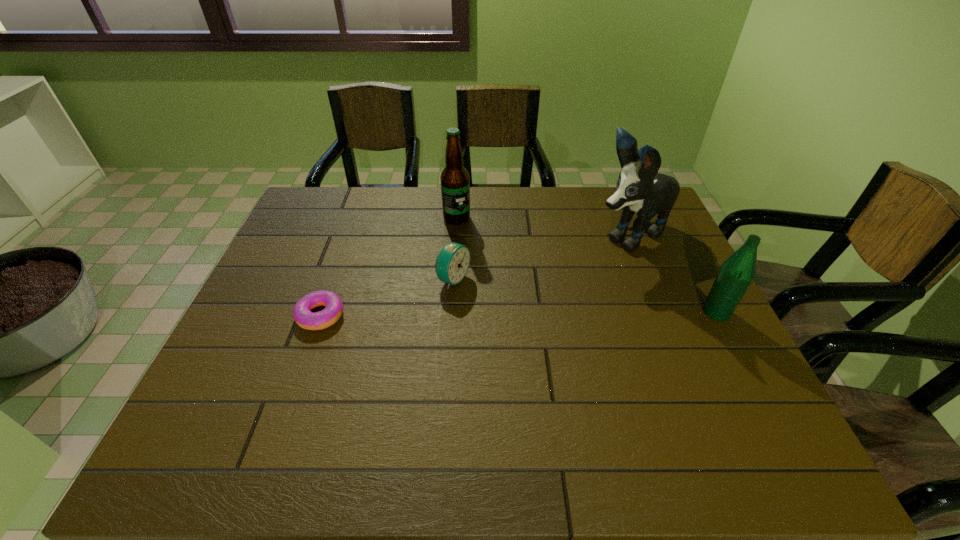
You are a GUI agent. You are given a task and a screenshot of the screen. Output one action in this format:
    pyautogui.click(x=<x>, y=<y>)
    Task: Click on the shortest object
    
    Given the screenshot: What is the action you would take?
    pyautogui.click(x=303, y=316)

Where is `doughnut`? doughnut is located at coordinates (x=303, y=316).

Identify the location of bottle. (735, 275).

Locate an element on the screen. the fourth tallest object is located at coordinates (452, 263).

This screenshot has width=960, height=540. I want to click on alarm clock, so click(x=452, y=263).

Image resolution: width=960 pixels, height=540 pixels. Identify the location of puppy. (640, 188).

Where is `beer bottle`? The image size is (960, 540). beer bottle is located at coordinates (455, 184).

This screenshot has width=960, height=540. Find the location of `blank space located on the back of the shortest object`. blank space located on the back of the shortest object is located at coordinates click(350, 232).

You are a GUI agent. You are given a task and a screenshot of the screen. Output one action in this format:
    pyautogui.click(x=<x>, y=<y>)
    Task: Click on the free space located on the back of the bottle
    The height and width of the screenshot is (540, 960).
    Given the screenshot: What is the action you would take?
    pyautogui.click(x=703, y=286)

Find the location of a particular element. The width and height of the screenshot is (960, 540). blank space located on the front-facing side of the alarm clock is located at coordinates (510, 305).